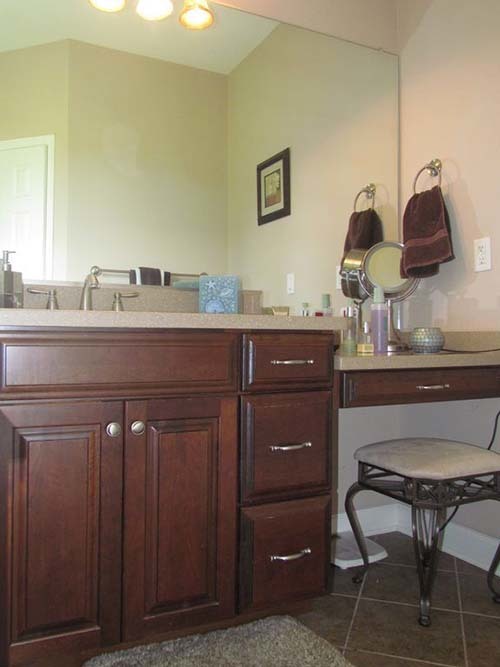
Find the location of a particular element. This screenshot has height=667, width=500. handles is located at coordinates (39, 289), (127, 293), (113, 430), (135, 430), (297, 362), (292, 447), (295, 558), (432, 388).